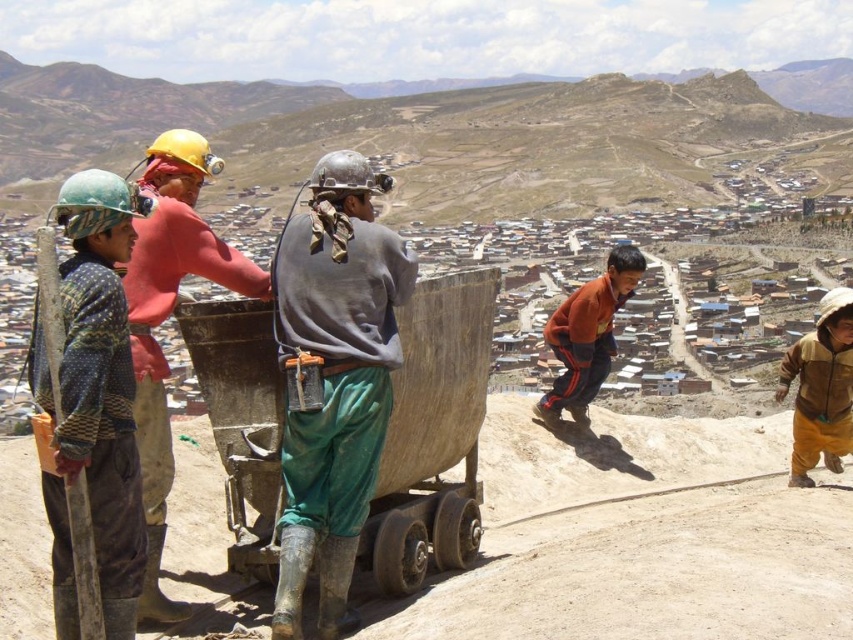
Question: Is knitted sweater at left positioned at the back of brown fuzzy jacket at right?

Choices:
 (A) yes
 (B) no

Answer: (B)

Question: Based on their relative distances, which object is nearer to the orange fleece jacket at center?

Choices:
 (A) knitted sweater at left
 (B) brown fuzzy jacket at right
 (C) matte yellow hard hat at upper left

Answer: (B)

Question: Does green fabric pants at center come behind matte yellow hard hat at upper left?

Choices:
 (A) no
 (B) yes

Answer: (A)

Question: Considering the real-world distances, which object is farthest from the green fabric pants at center?

Choices:
 (A) brown fuzzy jacket at right
 (B) orange fleece jacket at center
 (C) matte yellow hard hat at upper left
 (D) knitted sweater at left

Answer: (B)

Question: Which of the following is the farthest from the observer?

Choices:
 (A) (364, 506)
 (B) (618, 296)

Answer: (B)

Question: Does matte yellow hard hat at upper left appear over brown fuzzy jacket at right?

Choices:
 (A) no
 (B) yes

Answer: (B)